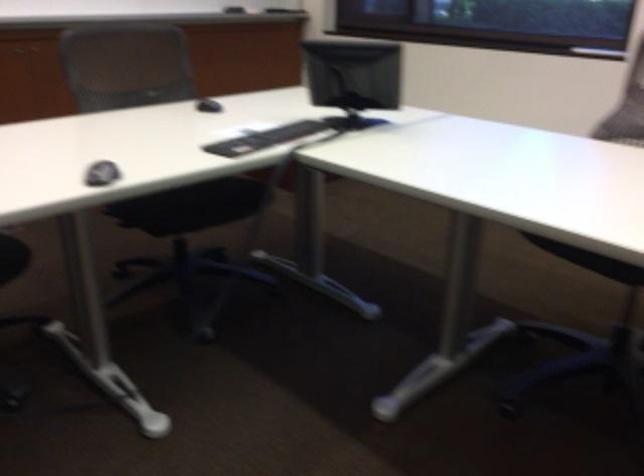
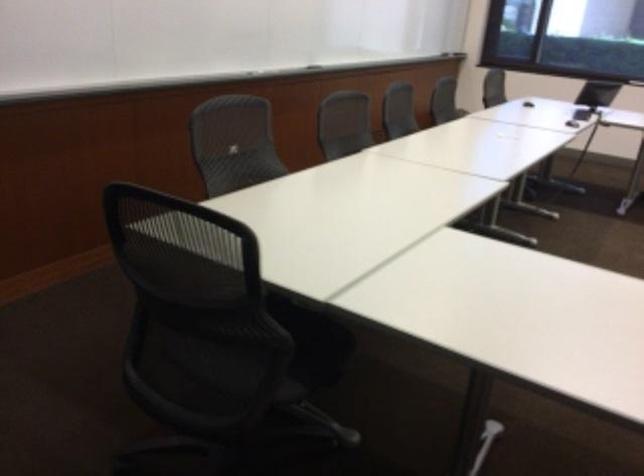
Which direction would the cameraman need to move to produce the second image?

The cameraman walked toward left, backward.